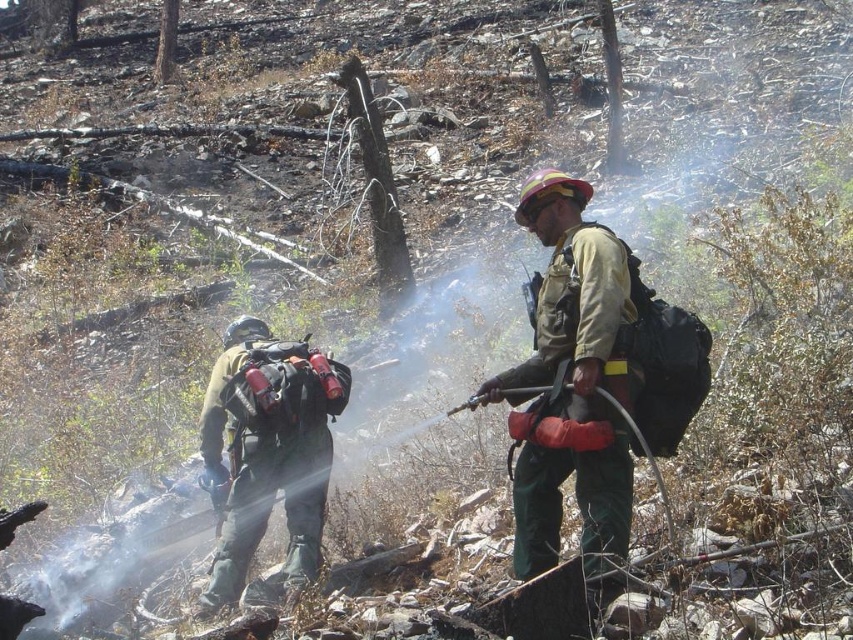
You are a firefighter supervisor observing the scene. You need to determine the relative positions of the two firefighters wearing green matte uniforms. Which firefighter is positioned higher in the image, the green matte uniform at center or the green matte uniform at left?

The green matte uniform at center is taller than the green matte uniform at left, so the firefighter in the green matte uniform at center is positioned higher in the image.